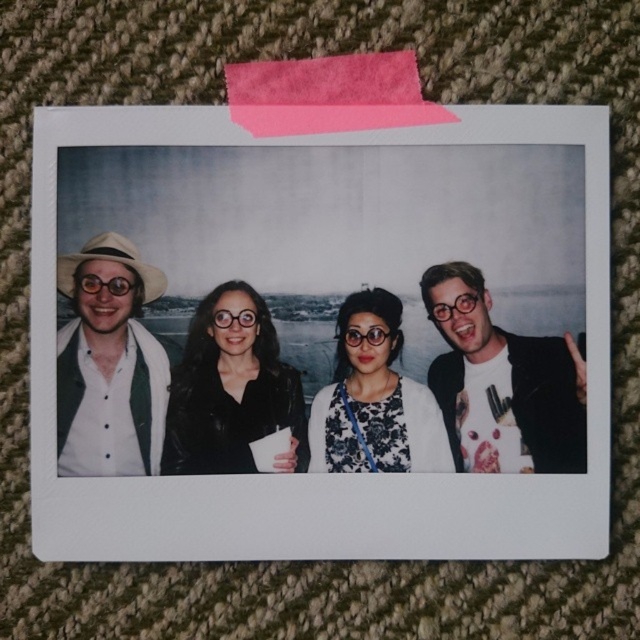
Is matte black jacket at right smaller than matte white hat at left?

Actually, matte black jacket at right might be larger than matte white hat at left.

This screenshot has height=640, width=640. I want to click on matte black jacket at right, so click(502, 384).

Is matte black jacket at right positioned behind black leather jacket at center?

No, it is in front of black leather jacket at center.

Find the location of a particular element. The image size is (640, 640). matte black jacket at right is located at coordinates (502, 384).

You are a GUI agent. You are given a task and a screenshot of the screen. Output one action in this format:
    pyautogui.click(x=<x>, y=<y>)
    Task: Click on the matte black jacket at right
    
    Given the screenshot: What is the action you would take?
    pyautogui.click(x=502, y=384)

Is matte white hat at left smaller than black leather jacket at center?

Correct, matte white hat at left occupies less space than black leather jacket at center.

Does matte white hat at left have a greater height compared to black leather jacket at center?

Yes.

Identify the location of matte white hat at left. The image size is (640, 640). (109, 364).